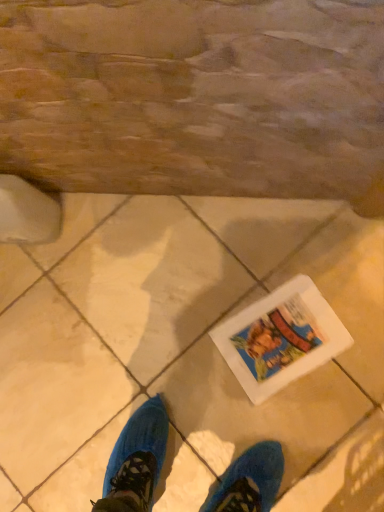
Find the location of a particular element. unoccupied space behind white matte comic book at lower center is located at coordinates (233, 266).